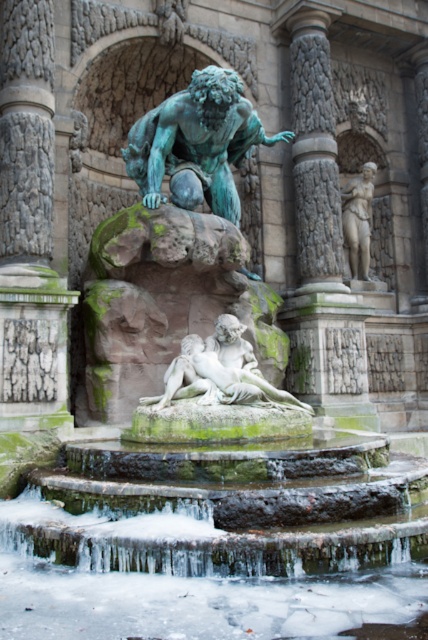
Can you confirm if icy stone water at center is taller than white marble statue at center-right?

In fact, icy stone water at center may be shorter than white marble statue at center-right.

Can you confirm if icy stone water at center is positioned above white marble statue at center-right?

No.

Does point (309, 579) lie behind point (347, 241)?

No, it is not.

This screenshot has height=640, width=428. I want to click on icy stone water at center, so click(x=213, y=547).

Does green patina bronze statue at center have a smaller size compared to white marble statue at center-right?

No.

Can you confirm if green patina bronze statue at center is positioned to the right of white marble statue at center-right?

In fact, green patina bronze statue at center is to the left of white marble statue at center-right.

Is point (229, 179) farther from viewer compared to point (357, 179)?

No, (229, 179) is in front of (357, 179).

At what (x,y) coordinates should I click in order to perform the action: click on green patina bronze statue at center. Please return your answer as a coordinate pair (x, y). Looking at the image, I should click on (196, 144).

Between green patina bronze statue at center and white marble statue at center, which one is positioned higher?

green patina bronze statue at center is higher up.

Is green patina bronze statue at center above white marble statue at center?

Correct, green patina bronze statue at center is located above white marble statue at center.

Measure the distance between point (181, 148) and camera.

They are 146.43 feet apart.

Image resolution: width=428 pixels, height=640 pixels. Identify the location of green patina bronze statue at center. (196, 144).